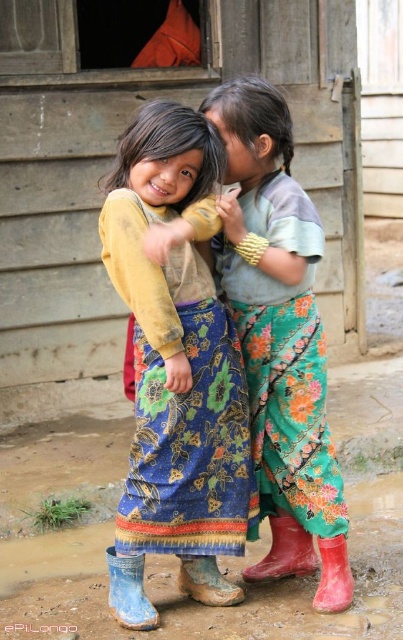
Question: Does floral fabric skirt at center appear on the right side of blue rubber boot at lower left?

Choices:
 (A) no
 (B) yes

Answer: (B)

Question: Is blue floral skirt at center positioned at the back of red rubber boot at lower center?

Choices:
 (A) yes
 (B) no

Answer: (B)

Question: Among these points, which one is nearest to the camera?

Choices:
 (A) (155, 321)
 (B) (263, 212)

Answer: (A)

Question: Can you confirm if blue floral skirt at center is bigger than red rubber boot at lower center?

Choices:
 (A) yes
 (B) no

Answer: (A)

Question: Which object is positioned farthest from the floral fabric skirt at center?

Choices:
 (A) blue rubber boot at lower left
 (B) red rubber boot at lower center

Answer: (A)

Question: Which object is the closest to the blue rubber boot at lower left?

Choices:
 (A) red rubber boot at lower center
 (B) floral fabric skirt at center

Answer: (A)